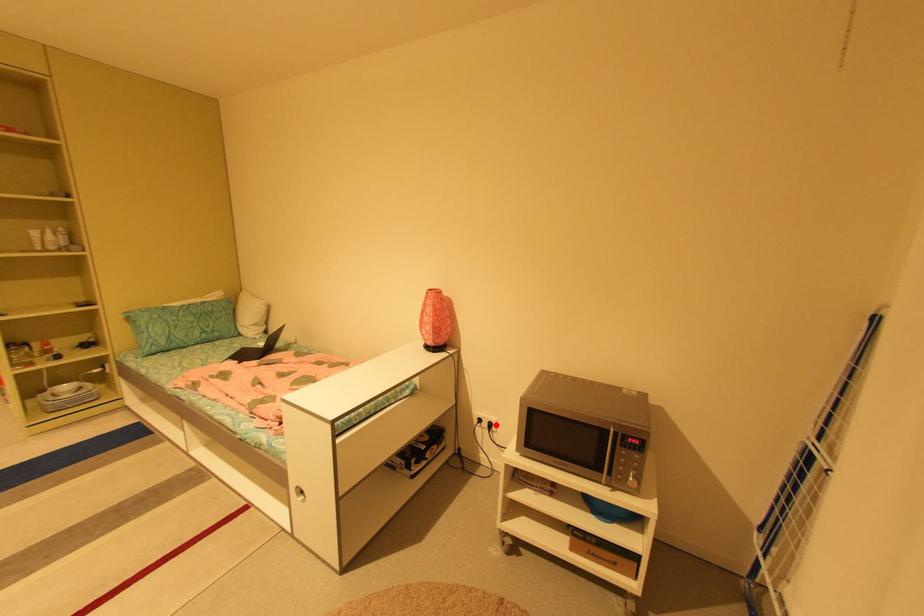
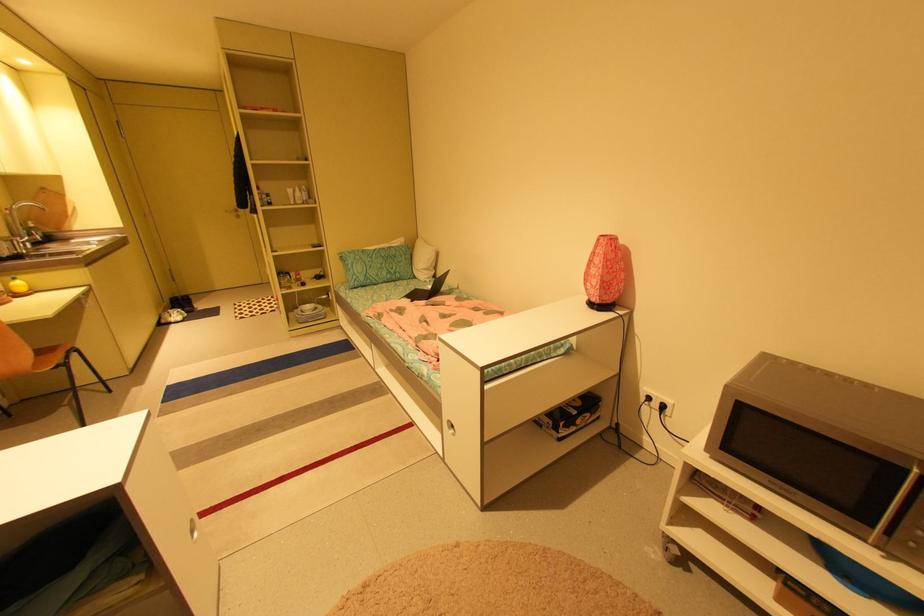
The point at the highlighted location is marked in the first image. Where is the corresponding point in the second image?

(669, 407)